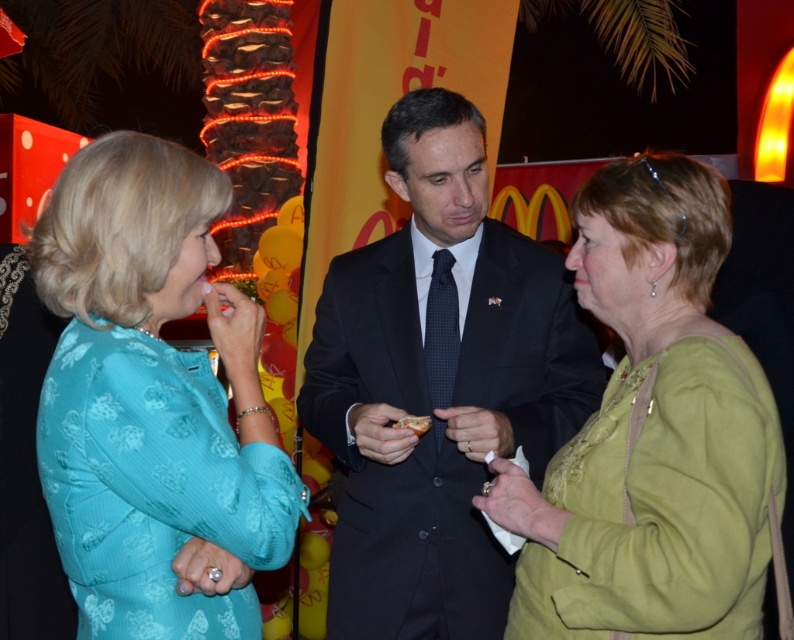
You are standing at the center of the image and want to move towards the two points marked in the scene. Which point, point (399, 321) or point (642, 458), is closer to you as you face the image?

Point (399, 321) is closer to you because it is further to the camera than point (642, 458), meaning it is nearer in the scene.

Looking at this image, you are a photographer at the McDonald event. You need to take a photo of the dark suit at center and golden crispy bread at center. Which object should you focus on first to ensure both are in frame?

The dark suit at center is taller than the golden crispy bread at center, so you should focus on the dark suit at center first to ensure both are in frame.